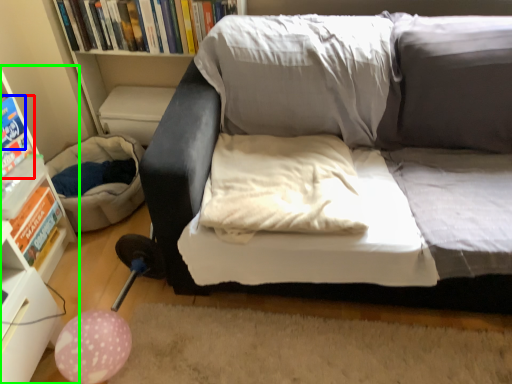
Question: Which object is the closest to the paperback book (highlighted by a red box)? Choose among these: paperback book (highlighted by a blue box) or shelf (highlighted by a green box).

Choices:
 (A) paperback book
 (B) shelf

Answer: (A)